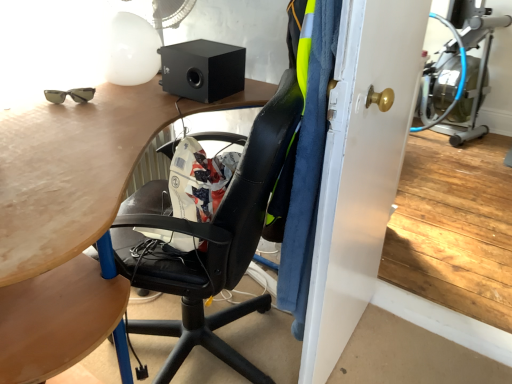
Question: In terms of size, does matte wood desk at center appear bigger or smaller than black matte speaker at upper center?

Choices:
 (A) big
 (B) small

Answer: (A)

Question: Would you say matte wood desk at center is to the left or to the right of black matte speaker at upper center in the picture?

Choices:
 (A) left
 (B) right

Answer: (A)

Question: Estimate the real-world distances between objects in this image. Which object is closer to the white plastic mechanical fan at upper center?

Choices:
 (A) matte wood desk at center
 (B) matte gold door handle at center
 (C) black matte speaker at upper center

Answer: (C)

Question: Estimate the real-world distances between objects in this image. Which object is farther from the matte wood desk at center?

Choices:
 (A) black matte speaker at upper center
 (B) white plastic mechanical fan at upper center
 (C) matte gold door handle at center

Answer: (B)